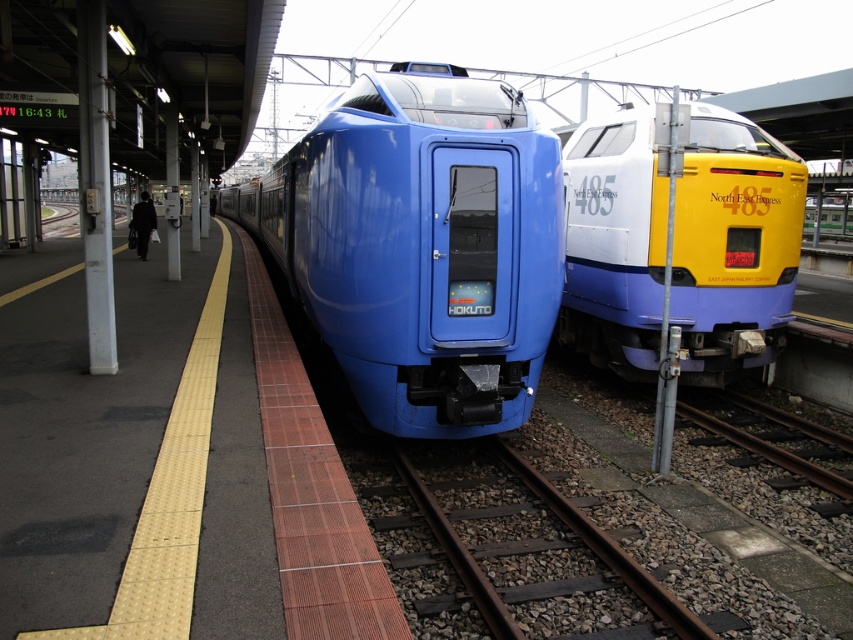
You are a maintenance worker who needs to inspect the gap between the matte blue train at center and the smooth metal track at lower right. According to safety regulations, the gap must not exceed 6 meters. Is the current gap within the safety limit?

The gap between the matte blue train at center and the smooth metal track at lower right is 5.86 meters, which is under the 6 meter safety limit. The gap is within the safety regulations.

You are standing at the tactile paving strip on the platform. You want to board the matte blue train at center. Which direction should you walk to reach it?

You should walk towards the center of the platform to reach the matte blue train at center located at point (421, 246).

You are a passenger standing on the platform at the train station. You see the matte blue train at center and the black fabric bag at left. Which object is wider?

The matte blue train at center is narrower than the black fabric bag at left, so the black fabric bag at left is wider.